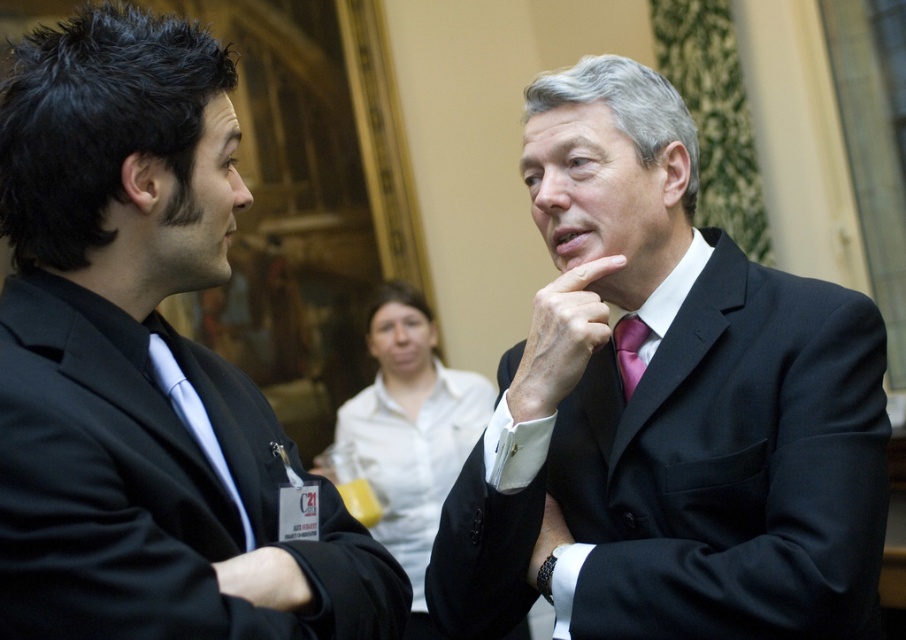
Question: Estimate the real-world distances between objects in this image. Which object is closer to the smooth skin hand at center?

Choices:
 (A) white glossy cup at center
 (B) pink satin tie at center
 (C) matte black suit at left

Answer: (B)

Question: Is white glossy cup at center positioned behind pink satin tie at center?

Choices:
 (A) no
 (B) yes

Answer: (B)

Question: Which object is the farthest from the white glossy cup at center?

Choices:
 (A) black suit at center
 (B) pink satin tie at center

Answer: (B)

Question: Does black suit at center lie in front of matte black suit at left?

Choices:
 (A) yes
 (B) no

Answer: (B)

Question: Among these objects, which one is farthest from the camera?

Choices:
 (A) black suit at center
 (B) smooth skin hand at center
 (C) matte black suit at left

Answer: (B)

Question: Can you confirm if white glossy cup at center is positioned to the left of pink satin tie at center?

Choices:
 (A) no
 (B) yes

Answer: (B)